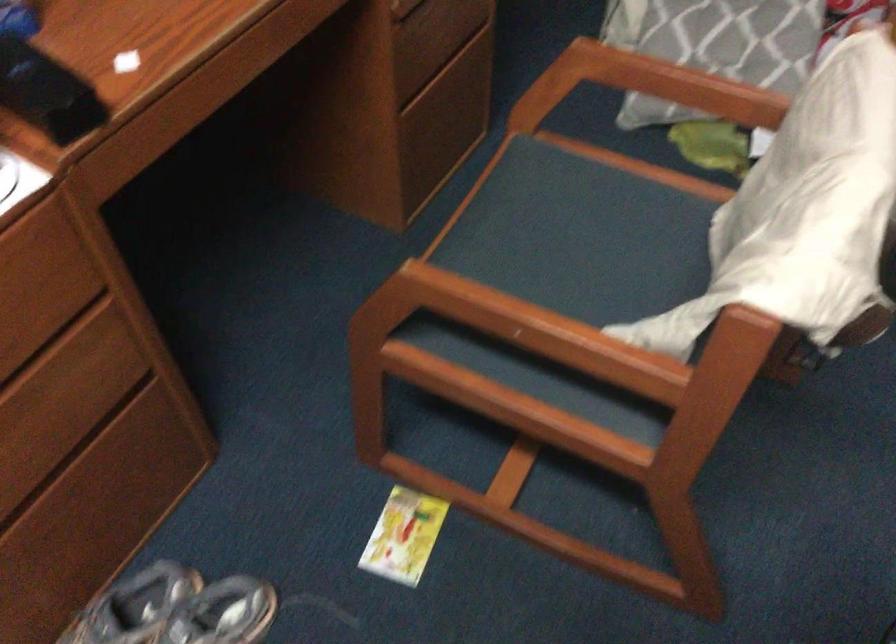
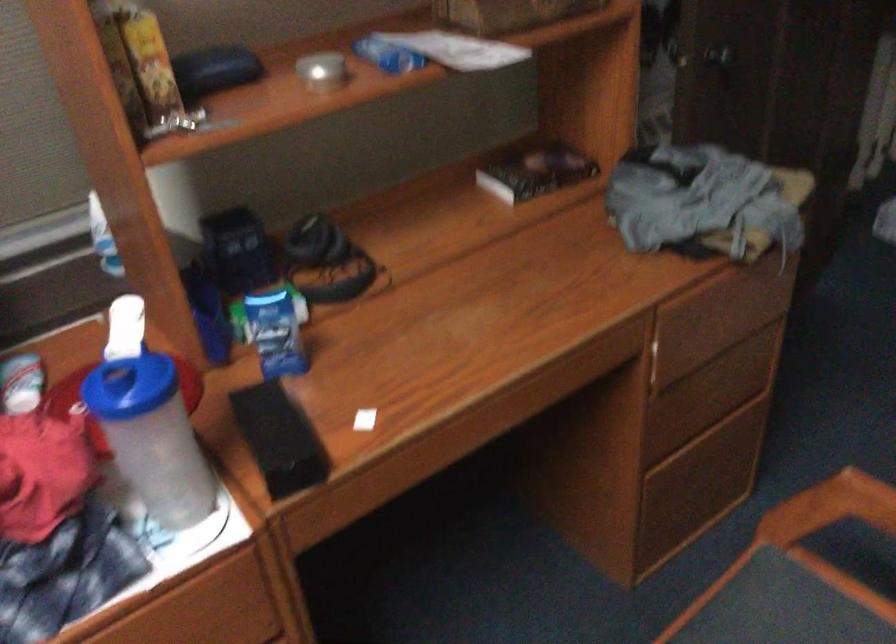
The point at (538, 185) is marked in the first image. Where is the corresponding point in the second image?

(780, 614)